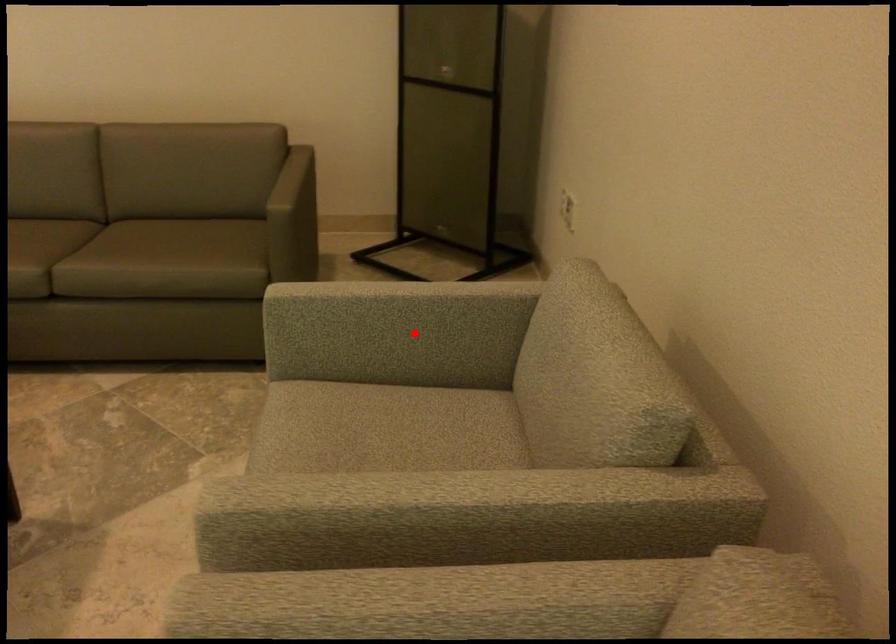
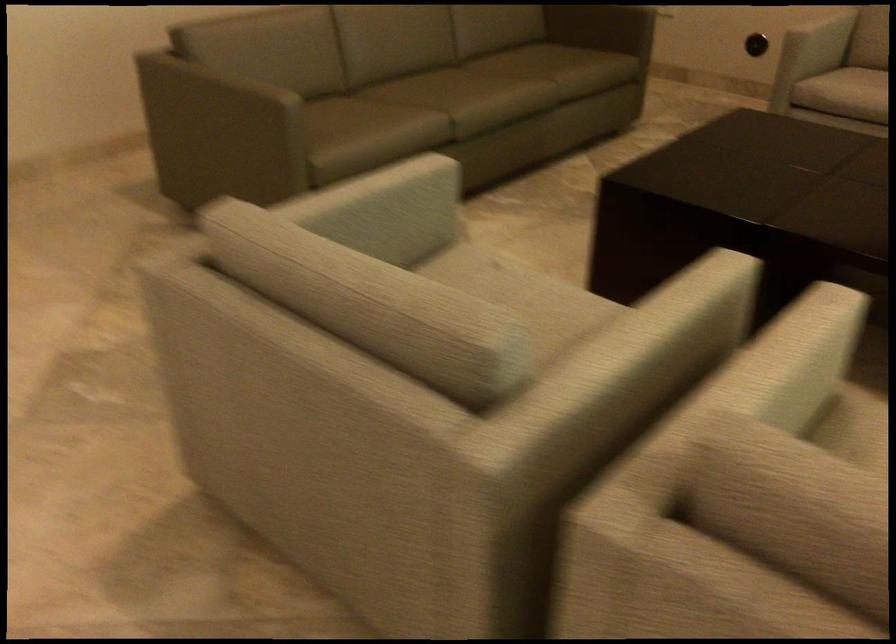
Question: I am providing you with two images of the same scene from different viewpoints. In image1, a red point is highlighted. Considering the same 3D point in image2, which of the following is correct?

Choices:
 (A) It is closer
 (B) It is farther

Answer: (B)